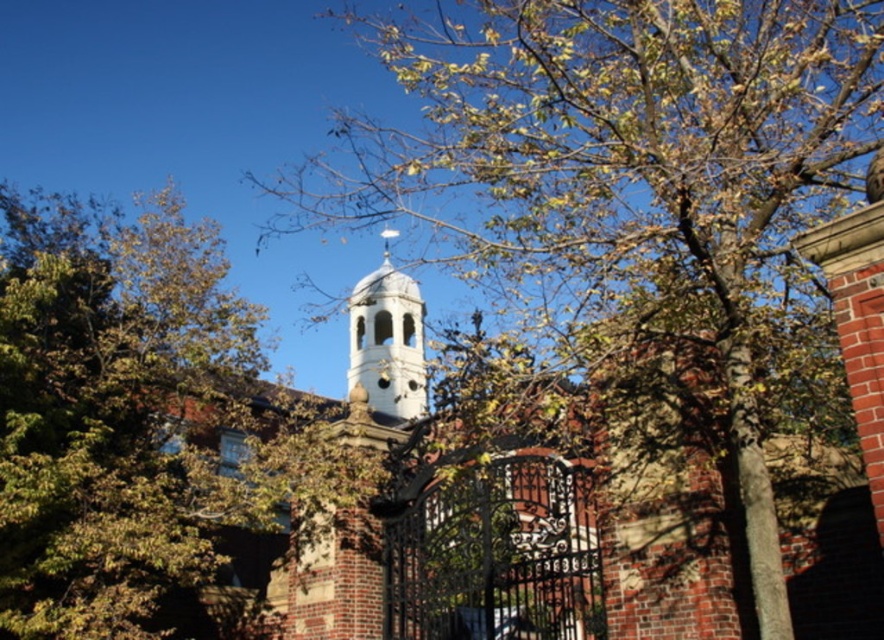
You are a drone operator trying to capture a photo of the historic building with its dome. You need to position your drone so that the brown leafy tree at center does not block the view of the dome. Based on the coordinates provided, can you determine if the tree is positioned in front of the dome or behind it?

The brown leafy tree at center is located at coordinates (638, 192). Since the dome is part of the main building structure, which is likely positioned centrally in the image, the tree at center would be in front of the dome, blocking the view.

You are standing in front of the historic building with the white dome. There are two points marked in the image. One is at coordinate point (881, 20) and the other is at point (171, 356). Which point is closer to you?

Point (881, 20) is closer to the camera than point (171, 356).

You are a photographer planning to capture a wide shot of the historic building and its surroundings. You have a camera with a 50mm lens, which has a field of view that can comfortably include objects up to 3 meters wide. Given the green leafy tree at upper center and the white stone bell tower at center, can you determine if both can fit within the frame without needing to adjust your position?

The green leafy tree at upper center might be wider than the white stone bell tower at center. Since the tree could be wider than 3 meters, it may not fit within the 50mm lens field of view which accommodates up to 3 meters. Therefore, adjusting your position might be necessary to ensure both fit comfortably.